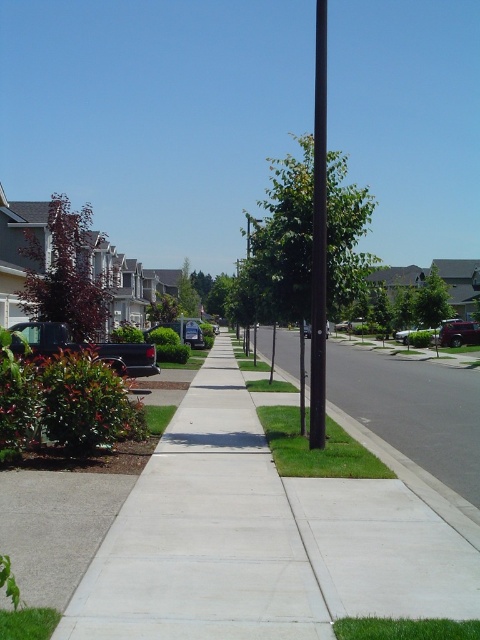
What do you see at coordinates (129, 356) in the screenshot?
I see `dark gray matte truck at lower left` at bounding box center [129, 356].

Measure the distance between dark gray matte truck at lower left and metallic red car at right.

105.34 feet

Between point (151, 365) and point (468, 339), which one is positioned behind?

Point (468, 339)

In order to click on dark gray matte truck at lower left in this screenshot , I will do `click(129, 356)`.

This screenshot has height=640, width=480. What do you see at coordinates (203, 534) in the screenshot?
I see `green concrete sidewalk at center` at bounding box center [203, 534].

Between green concrete sidewalk at center and metallic red car at right, which one has more height?

Standing taller between the two is metallic red car at right.

At what (x,y) coordinates should I click in order to perform the action: click on green concrete sidewalk at center. Please return your answer as a coordinate pair (x, y). Looking at the image, I should click on (203, 534).

You are a GUI agent. You are given a task and a screenshot of the screen. Output one action in this format:
    pyautogui.click(x=<x>, y=<y>)
    Task: Click on the green concrete sidewalk at center
    The image size is (480, 640).
    Given the screenshot: What is the action you would take?
    pyautogui.click(x=203, y=534)

Between point (451, 321) and point (429, 326), which one is positioned in front?

Point (451, 321) is more forward.

Which is above, metallic red car at right or metallic silver sedan at center-right?

metallic silver sedan at center-right is higher up.

Between point (441, 333) and point (405, 333), which one is positioned in front?

Positioned in front is point (441, 333).

At what (x,y) coordinates should I click in order to perform the action: click on metallic red car at right. Please return your answer as a coordinate pair (x, y). The width and height of the screenshot is (480, 640). Looking at the image, I should click on (458, 333).